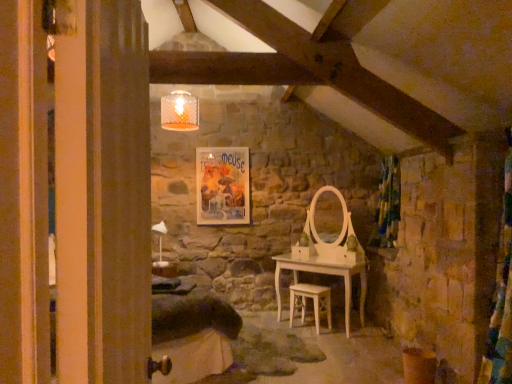
Question: Is point (373, 241) closer or farther from the camera than point (212, 183)?

Choices:
 (A) farther
 (B) closer

Answer: (B)

Question: From the image's perspective, is velvet green curtain at right above or below matte paper poster at center?

Choices:
 (A) above
 (B) below

Answer: (B)

Question: Which object is the farthest from the velvet green curtain at right?

Choices:
 (A) light wood chair at center
 (B) matte paper poster at center

Answer: (B)

Question: Which object is positioned closest to the light wood chair at center?

Choices:
 (A) matte paper poster at center
 (B) velvet green curtain at right

Answer: (B)